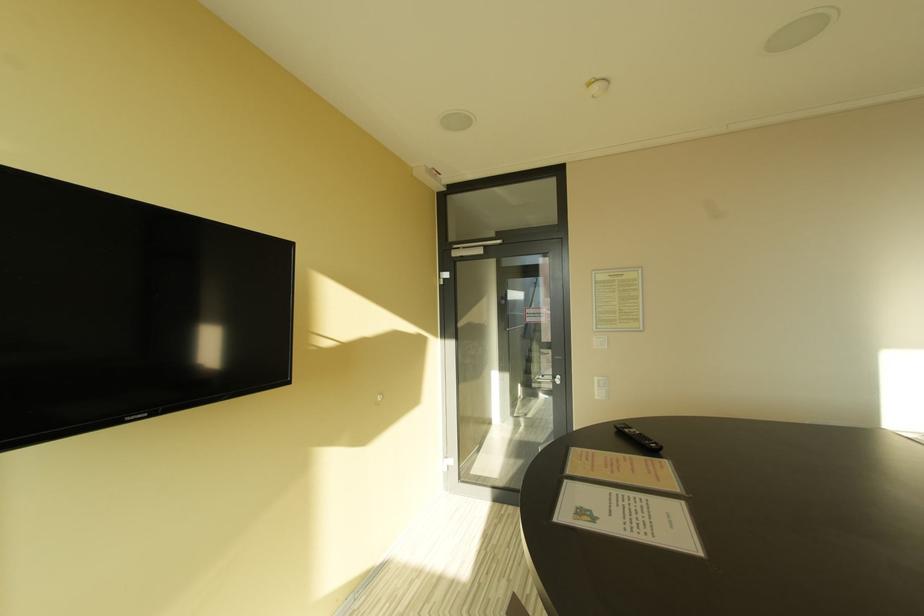
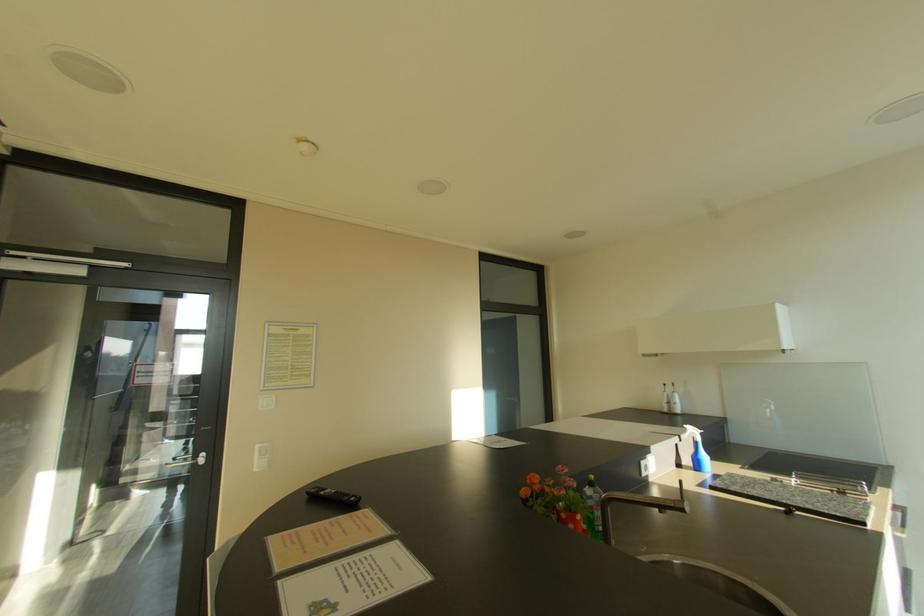
Question: How did the camera likely rotate?

Choices:
 (A) Left
 (B) Right
 (C) Up
 (D) Down

Answer: (B)